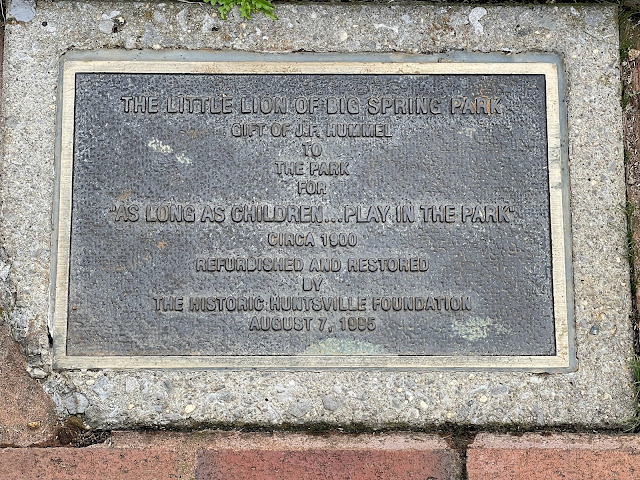
Where is `center plaque`? center plaque is located at coordinates (124, 186), (465, 179).